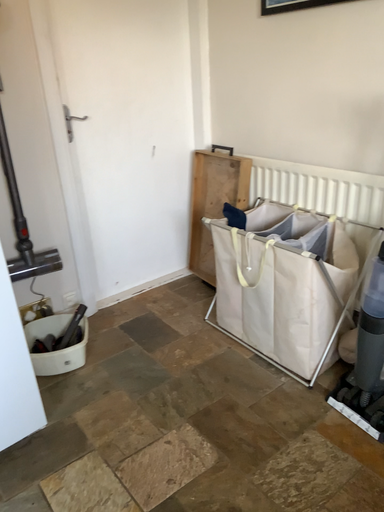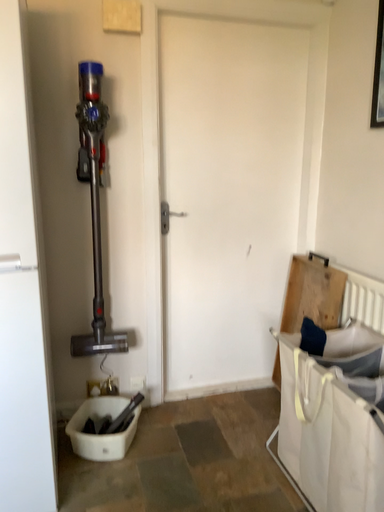
Question: Which way did the camera rotate in the video?

Choices:
 (A) rotated upward
 (B) rotated downward

Answer: (A)